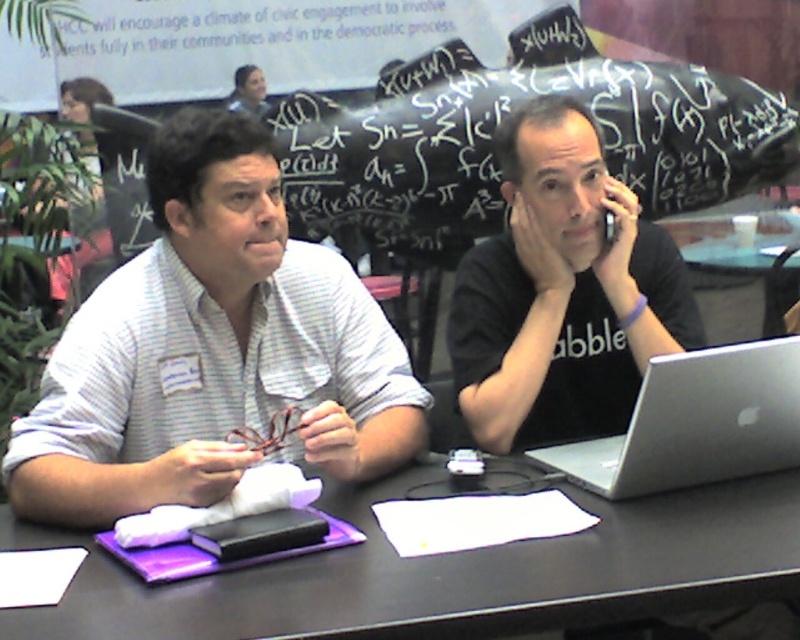
What is located at the coordinates point (449, 573) in the image?

The point (449, 573) indicates the black matte table at center.

You are standing in the conference room and want to take a photo of the point at coordinates (784, 484). The camera you have can only focus on objects within 1.5 meters. Will the point be in focus?

The point at coordinates (784, 484) is 1.47 meters away from the camera, so it will be within the focus range and in focus.